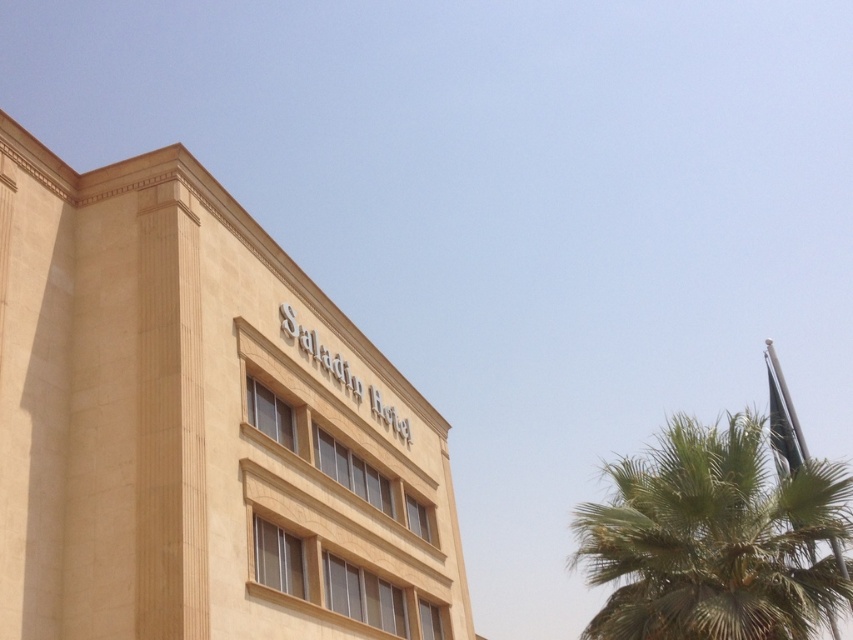
What do you see at coordinates (200, 426) in the screenshot? This screenshot has width=853, height=640. I see `beige stone saladin hotel at upper center` at bounding box center [200, 426].

Does beige stone saladin hotel at upper center come behind green leafy palm tree at right?

Yes, it is.

Is point (201, 493) closer to camera compared to point (727, 636)?

No.

Where is `beige stone saladin hotel at upper center`? Image resolution: width=853 pixels, height=640 pixels. beige stone saladin hotel at upper center is located at coordinates (200, 426).